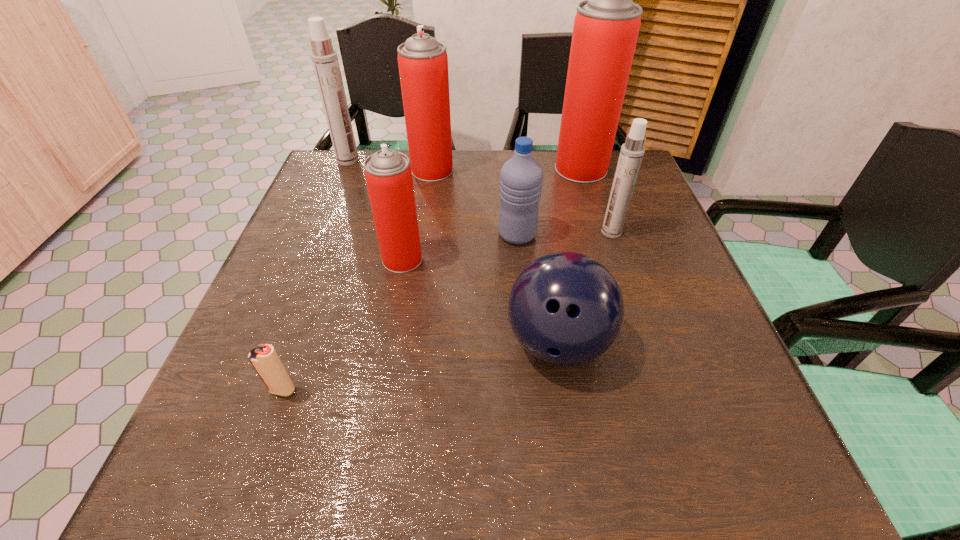
The height and width of the screenshot is (540, 960). I want to click on bowling ball, so click(x=566, y=309).

The height and width of the screenshot is (540, 960). Identify the location of blue bowling ball. (566, 309).

Identify the location of red igniter. (265, 360).

This screenshot has height=540, width=960. I want to click on igniter, so click(x=265, y=360).

You are a GUI agent. You are given a task and a screenshot of the screen. Output one action in this format:
    pyautogui.click(x=<x>, y=<y>)
    Task: Click on the vacant space located 0.350m on the front of the biggest red aerosol can
    The height and width of the screenshot is (540, 960).
    Given the screenshot: What is the action you would take?
    pyautogui.click(x=613, y=278)

Locate an element on the screen. vacant area located on the right of the second biggest red aerosol can is located at coordinates (570, 171).

Where is `free space located on the right of the bigger white aerosol can`? free space located on the right of the bigger white aerosol can is located at coordinates (391, 160).

The height and width of the screenshot is (540, 960). Identify the location of free space located 0.300m on the back of the nearest aerosol can. (419, 173).

Locate an element on the screen. Image resolution: width=960 pixels, height=540 pixels. vacant point located on the back of the right white aerosol can is located at coordinates (596, 188).

This screenshot has width=960, height=540. In order to click on free space located on the right of the water bottle in this screenshot , I will do `click(650, 235)`.